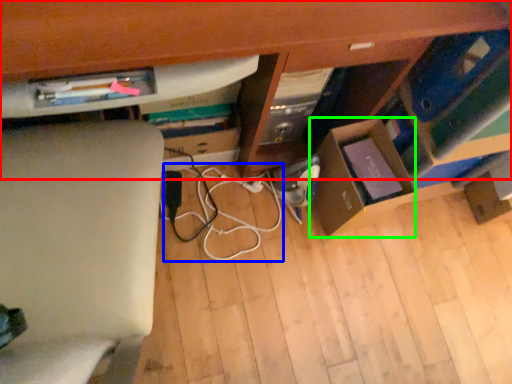
Question: Estimate the real-world distances between objects in this image. Which object is farther from computer desk (highlighted by a red box), string (highlighted by a blue box) or cardboard box (highlighted by a green box)?

Choices:
 (A) string
 (B) cardboard box

Answer: (A)